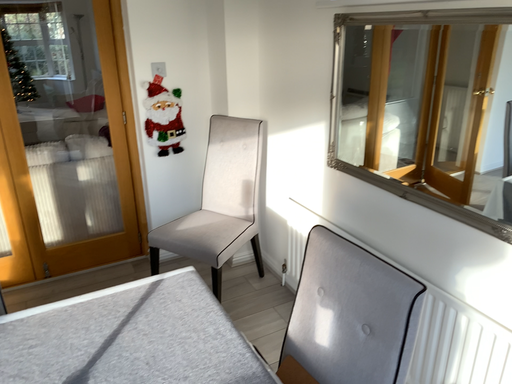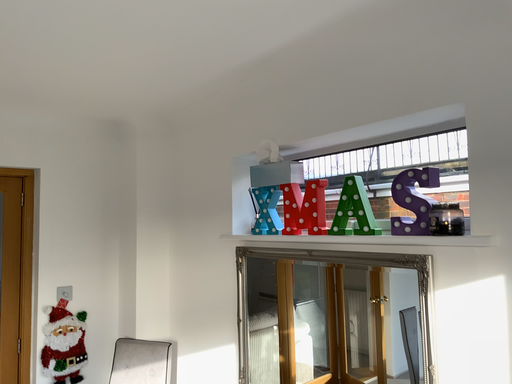
Question: Which way did the camera rotate in the video?

Choices:
 (A) rotated downward
 (B) rotated upward

Answer: (B)